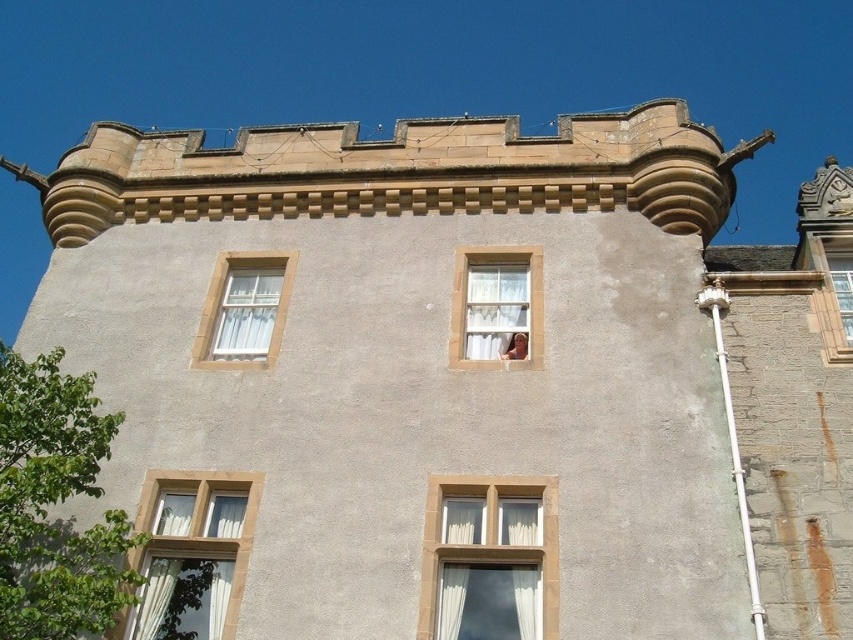
Is point (422, 611) closer to viewer compared to point (828, 340)?

Yes, point (422, 611) is closer to viewer.

Measure the distance between white textured window at center and camera.

The distance of white textured window at center from camera is 103.12 feet.

The height and width of the screenshot is (640, 853). Find the location of `white textured window at center`. white textured window at center is located at coordinates (489, 538).

Can you confirm if white textured window at lower left is positioned above white textured curtain at center?

No, white textured window at lower left is not above white textured curtain at center.

Between point (212, 588) and point (480, 273), which one is positioned in front?

Point (212, 588) is in front.

Between point (167, 474) and point (524, 323), which one is positioned behind?

Point (524, 323)

Find the location of `white textured window at lower left`. white textured window at lower left is located at coordinates (195, 544).

Is white textured window at lower left positioned in front of white textured window at center?

Yes, it is in front of white textured window at center.

Who is higher up, white textured window at lower left or white textured window at center?

white textured window at center is above.

This screenshot has height=640, width=853. Find the location of `white textured window at lower left`. white textured window at lower left is located at coordinates (195, 544).

Locate an element on the screen. The height and width of the screenshot is (640, 853). white textured window at lower left is located at coordinates (195, 544).